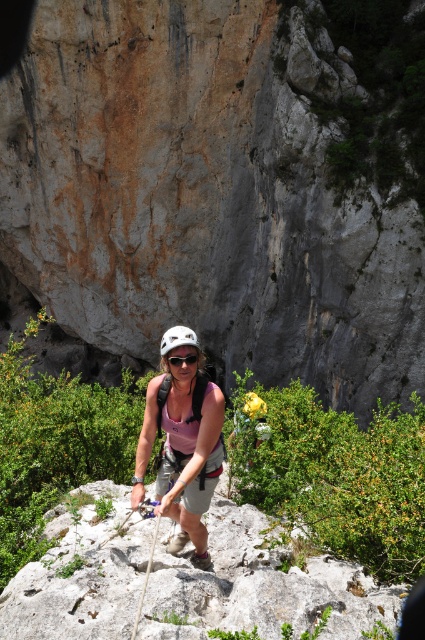
Question: Does green leafy hillside at center have a lesser width compared to white matte helmet at center?

Choices:
 (A) no
 (B) yes

Answer: (A)

Question: Estimate the real-world distances between objects in this image. Which object is farther from the white matte helmet at center?

Choices:
 (A) pink fabric helmet at center
 (B) yellow matte flower at center

Answer: (A)

Question: Among these points, which one is nearest to the camera?

Choices:
 (A) (260, 410)
 (B) (187, 330)

Answer: (B)

Question: Which point is closer to the camera taking this photo?

Choices:
 (A) (176, 372)
 (B) (192, 346)
 (C) (198, 353)

Answer: (B)

Question: Does green leafy hillside at center have a smaller size compared to pink fabric helmet at center?

Choices:
 (A) yes
 (B) no

Answer: (B)

Question: Can you confirm if pink fabric helmet at center is bigger than matte black goggles at center?

Choices:
 (A) no
 (B) yes

Answer: (B)